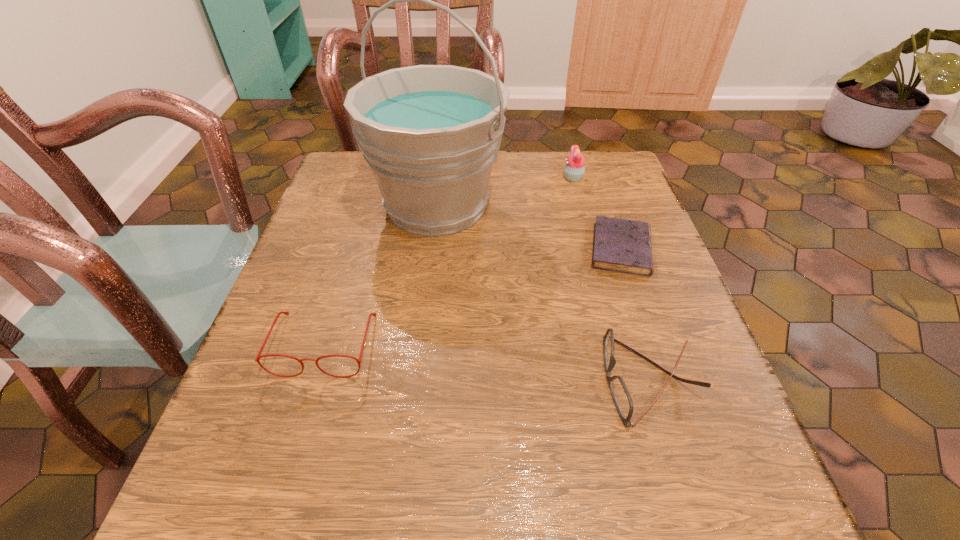
I want to click on free space located 0.240m on the face of the fourth shortest object, so click(x=469, y=178).

Identify the location of vacant region located 0.230m on the face of the third shortest object. point(265,537).

Locate an element on the screen. This screenshot has width=960, height=540. vacant region located on the front-facing side of the shorter spectacles is located at coordinates (439, 380).

Where is `vacant region located 0.180m on the front-facing side of the shorter spectacles`? vacant region located 0.180m on the front-facing side of the shorter spectacles is located at coordinates (494, 380).

Where is `vacant space located 0.350m on the front-facing side of the shorter spectacles`? This screenshot has height=540, width=960. vacant space located 0.350m on the front-facing side of the shorter spectacles is located at coordinates (390, 380).

In order to click on free space located on the front of the shortest object in this screenshot , I will do [665, 377].

I want to click on bucket that is positioned at the far edge, so click(x=430, y=134).

The width and height of the screenshot is (960, 540). In order to click on cupcake positioned at the far edge in this screenshot , I will do `click(574, 169)`.

At what (x,y) coordinates should I click in order to perform the action: click on bucket that is at the left edge. Please return your answer as a coordinate pair (x, y). Looking at the image, I should click on (430, 134).

The image size is (960, 540). I want to click on spectacles that is at the left edge, so click(258, 356).